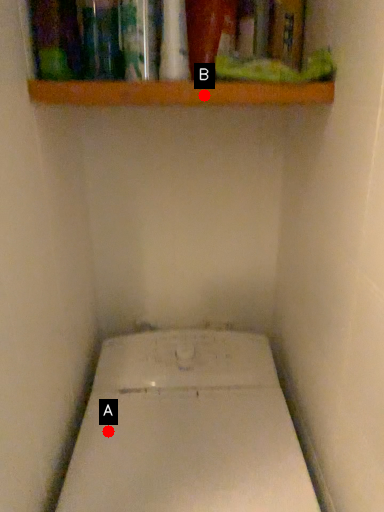
Question: Two points are circled on the image, labeled by A and B beside each circle. Which point is closer to the camera?

Choices:
 (A) A is closer
 (B) B is closer

Answer: (B)